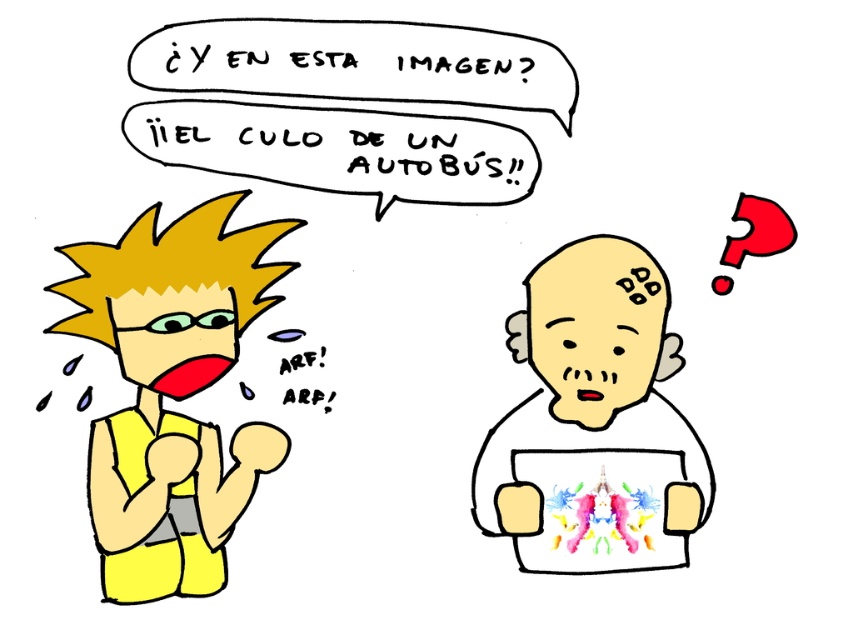
Question: Among these objects, which one is farthest from the camera?

Choices:
 (A) smooth beige head at center
 (B) yellow matte/silky hair at left

Answer: (A)

Question: Is smooth beige head at center wider than yellow matte/silky hair at left?

Choices:
 (A) yes
 (B) no

Answer: (A)

Question: Can you confirm if smooth beige head at center is smaller than yellow matte/silky hair at left?

Choices:
 (A) no
 (B) yes

Answer: (B)

Question: Which of the following is the closest to the observer?

Choices:
 (A) yellow matte/silky hair at left
 (B) smooth beige head at center

Answer: (A)

Question: Can you confirm if smooth beige head at center is bigger than yellow matte/silky hair at left?

Choices:
 (A) no
 (B) yes

Answer: (A)